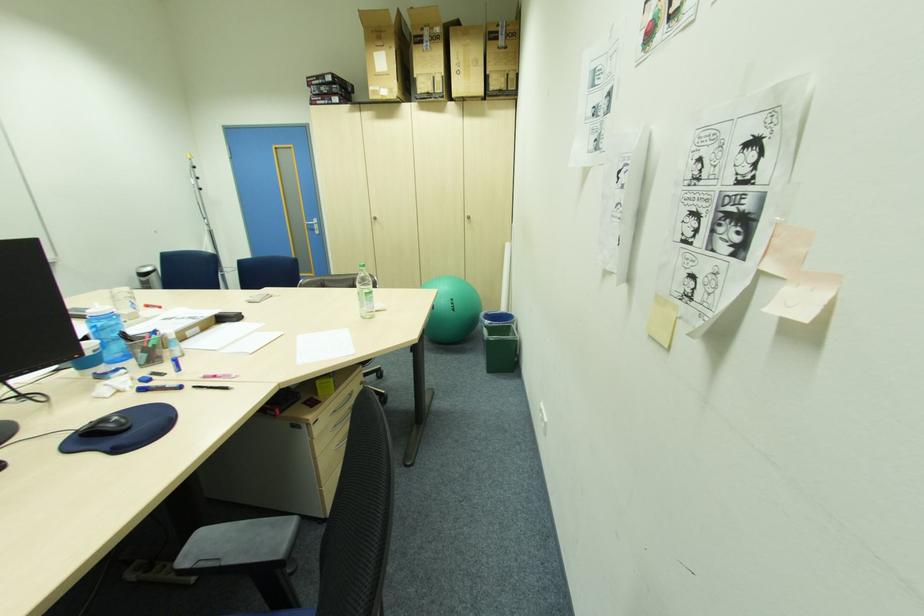
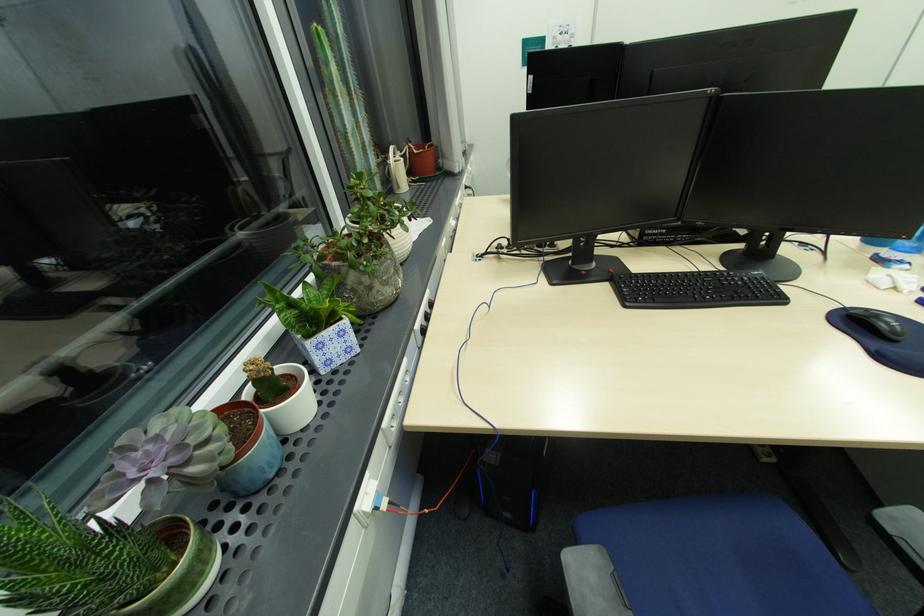
In the second image, find the point that corresponds to the point at 81,432 in the first image.

(849, 310)